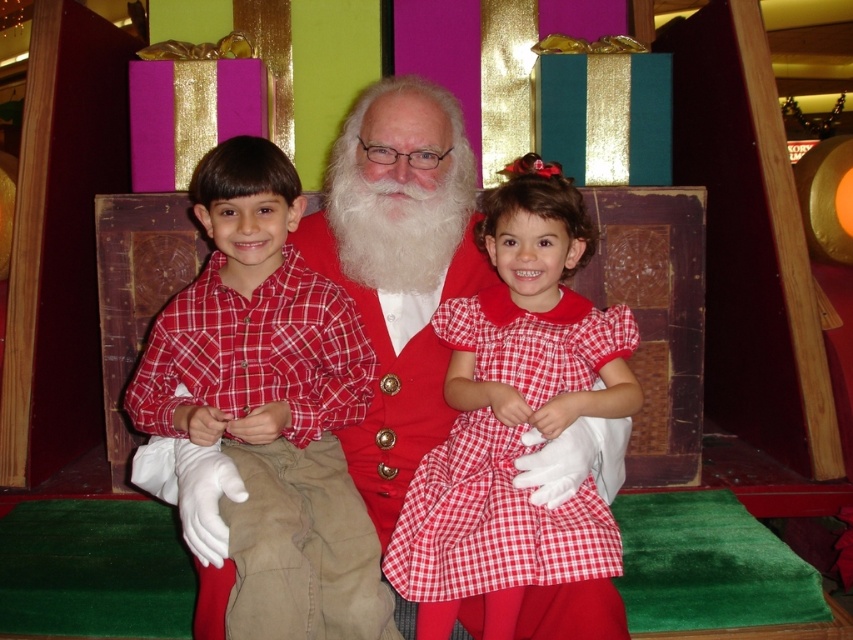
In the festive photo, there are two children sitting next to each other. The boy is wearing a red plaid shirt at center, and the girl is wearing a red checkered dress at center. From the photographer s perspective, which child is positioned to the left?

The red plaid shirt at center is to the left of the red checkered dress at center, so the boy wearing the red plaid shirt at center is positioned to the left.

You are a photographer trying to decide where to place a decorative wreath in the photo. The wreath is the same size as the red checkered dress at center. Will the wreath fit in the space currently occupied by the red plaid shirt at center?

The red plaid shirt at center is bigger than the red checkered dress at center. Since the wreath is the same size as the red checkered dress at center, it will not fit in the space occupied by the red plaid shirt at center because the shirt is larger.